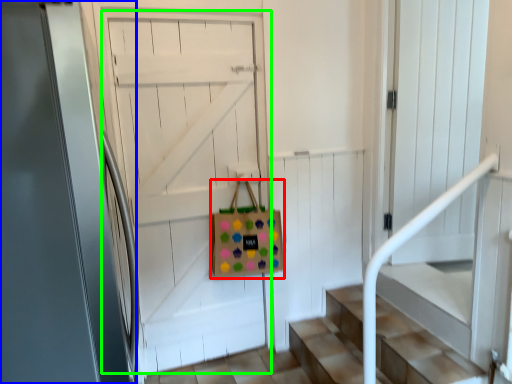
Question: Estimate the real-world distances between objects in this image. Which object is farther from shopping bag (highlighted by a red box), door (highlighted by a blue box) or door (highlighted by a green box)?

Choices:
 (A) door
 (B) door

Answer: (A)